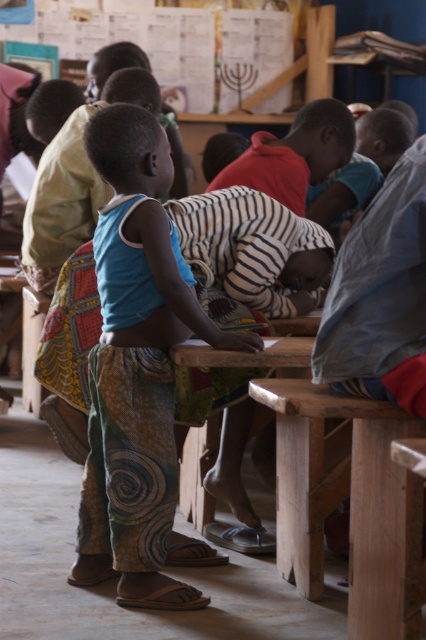
Looking at this image, which of these two, blue cotton shirt at center or striped fabric shirt at center, stands taller?

With more height is blue cotton shirt at center.

Which is in front, point (135, 188) or point (296, 120)?

Point (135, 188) is in front.

The image size is (426, 640). Find the location of `blue cotton shirt at center`. blue cotton shirt at center is located at coordinates (137, 368).

Between point (299, 168) and point (307, 356), which one is positioned in front?

Point (307, 356) is more forward.

Which is above, striped fabric shirt at center or wooden table at center?

striped fabric shirt at center is higher up.

Identify the location of striped fabric shirt at center. The height and width of the screenshot is (640, 426). (293, 154).

Locate an element on the screen. striped fabric shirt at center is located at coordinates (293, 154).

Measure the distance from blue cotton shirt at center to wooden table at center.

The distance of blue cotton shirt at center from wooden table at center is 19.31 inches.

Is point (149, 547) more distant than point (196, 353)?

Yes, it is.

Which is behind, point (141, 348) or point (270, 356)?

Point (141, 348)

You are a GUI agent. You are given a task and a screenshot of the screen. Output one action in this format:
    pyautogui.click(x=<x>, y=<y>)
    Task: Click on the blue cotton shirt at center
    
    Given the screenshot: What is the action you would take?
    pos(137,368)